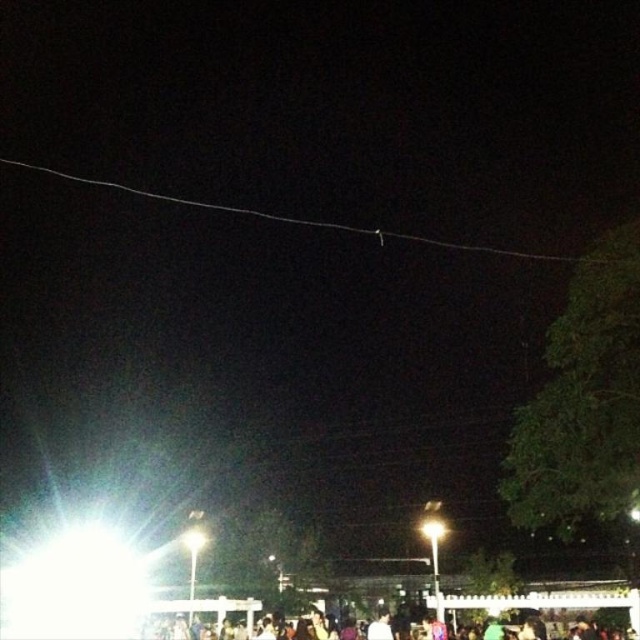
You are a photographer trying to capture a clear image of the dark clothing crowd at lower center without the white wire at upper center appearing in the frame. Based on their positions, can you adjust your camera angle to achieve this?

The white wire at upper center is to the left of the dark clothing crowd at lower center. By shifting the camera angle slightly to the right, you can position the camera so that the white wire at upper center is no longer in the frame while still capturing the dark clothing crowd at lower center.

You are a photographer standing at the camera position in the image. You want to adjust your camera settings to avoid overexposure caused by the bright light source in the lower left corner. However, you also need to ensure that the white wire at upper center remains visible in the photo. What should you do?

The white wire at upper center and camera are 122.23 feet apart from each other. To avoid overexposure from the bright light source in the lower left corner while keeping the white wire visible, you should adjust your camera settings to reduce exposure compensation or use a smaller aperture to limit the amount of light entering the lens. This will help balance the brightness between the bright light and the distant white wire.

You are a delivery drone operator. Your drone is currently hovering above the white wire at upper center. You need to deliver a package to the dark clothing crowd at lower center. According to the scene description, can your drone safely descend vertically to drop the package without hitting any obstacles?

The distance between the white wire at upper center and the dark clothing crowd at lower center is 191.92 feet. Since the drone is descending vertically, it would need to descend 191.92 feet to reach the crowd. However, this distance seems extremely large for a typical drone operation. Most consumer drones have a limited flight range and altitude capability. Without specific information about the drone model and its maximum descent capacity, it is impossible to confirm if the drone can safely descend that 1